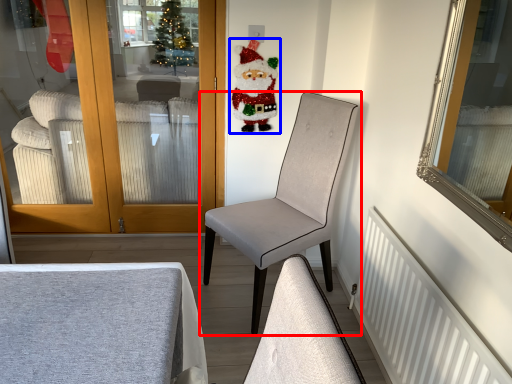
Question: Which object appears farthest to the camera in this image, chair (highlighted by a red box) or santa claus (highlighted by a blue box)?

Choices:
 (A) chair
 (B) santa claus

Answer: (B)